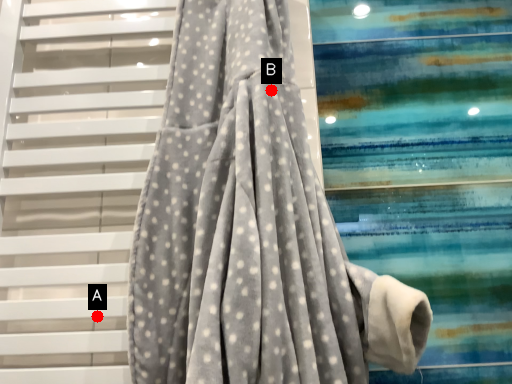
Question: Two points are circled on the image, labeled by A and B beside each circle. Which of the following is the farthest from the observer?

Choices:
 (A) A is further
 (B) B is further

Answer: (B)